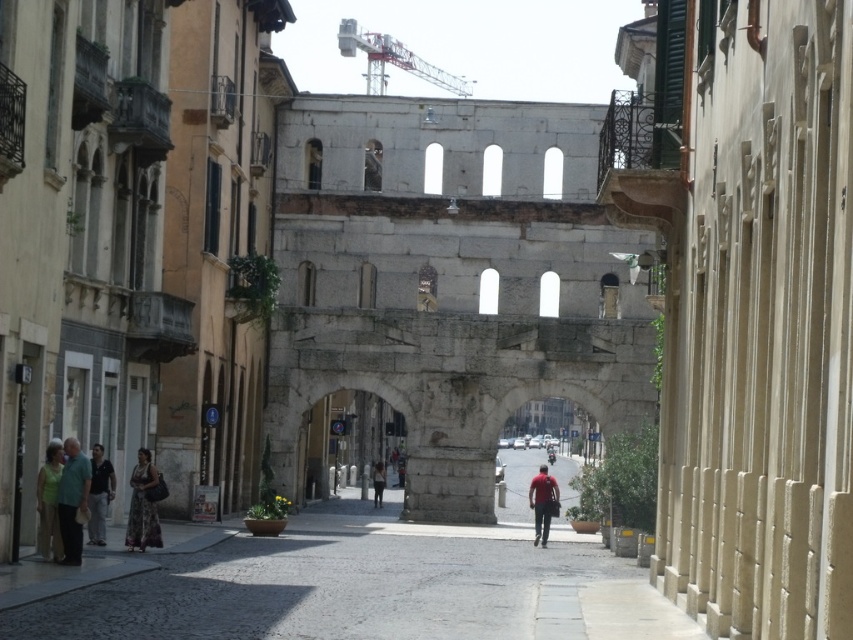
Who is positioned more to the right, green fabric dress at lower left or matte red shirt at center?

Positioned to the right is matte red shirt at center.

Does green fabric dress at lower left have a greater width compared to matte red shirt at center?

Incorrect, green fabric dress at lower left's width does not surpass matte red shirt at center's.

Between point (39, 493) and point (548, 504), which one is positioned in front?

Point (39, 493) is more forward.

Find the location of a particular element. The height and width of the screenshot is (640, 853). green fabric dress at lower left is located at coordinates (49, 502).

Between green fabric dress at lower left and dark brown leather jacket at center, which one appears on the right side from the viewer's perspective?

dark brown leather jacket at center

Locate an element on the screen. This screenshot has height=640, width=853. green fabric dress at lower left is located at coordinates (49, 502).

Which is in front, point (62, 458) or point (376, 465)?

Point (62, 458)

I want to click on green fabric dress at lower left, so click(49, 502).

Between dark gray fabric pants at lower left and dark brown leather jacket at center, which one has less height?

With less height is dark gray fabric pants at lower left.

Does dark gray fabric pants at lower left appear over dark brown leather jacket at center?

Yes.

Identify the location of dark gray fabric pants at lower left. This screenshot has width=853, height=640. (99, 493).

Locate an element on the screen. dark gray fabric pants at lower left is located at coordinates (99, 493).